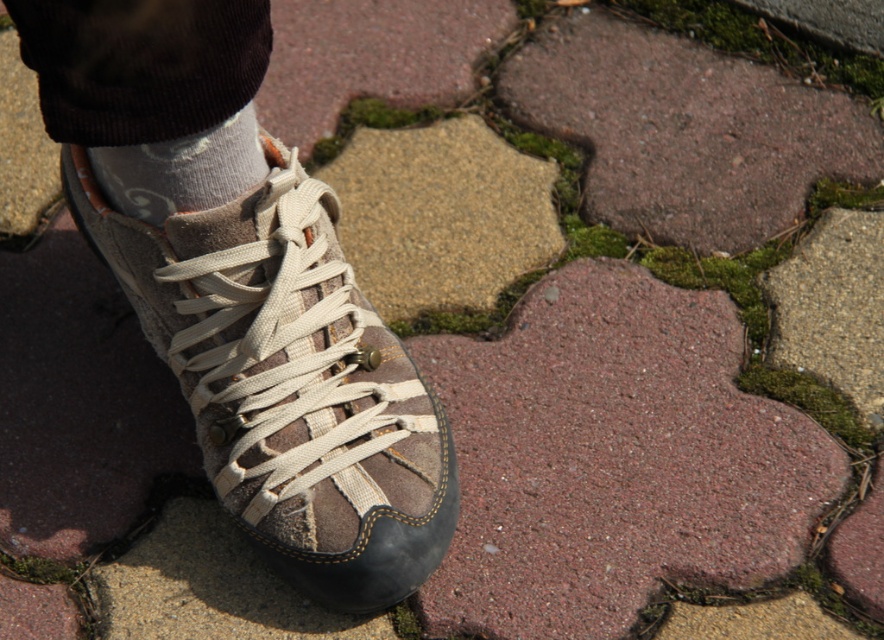
Does point (413, 548) come farther from viewer compared to point (116, 156)?

Yes, it is behind point (116, 156).

In order to click on brown suede boot at center in this screenshot , I will do `click(288, 381)`.

The height and width of the screenshot is (640, 884). I want to click on brown suede boot at center, so click(288, 381).